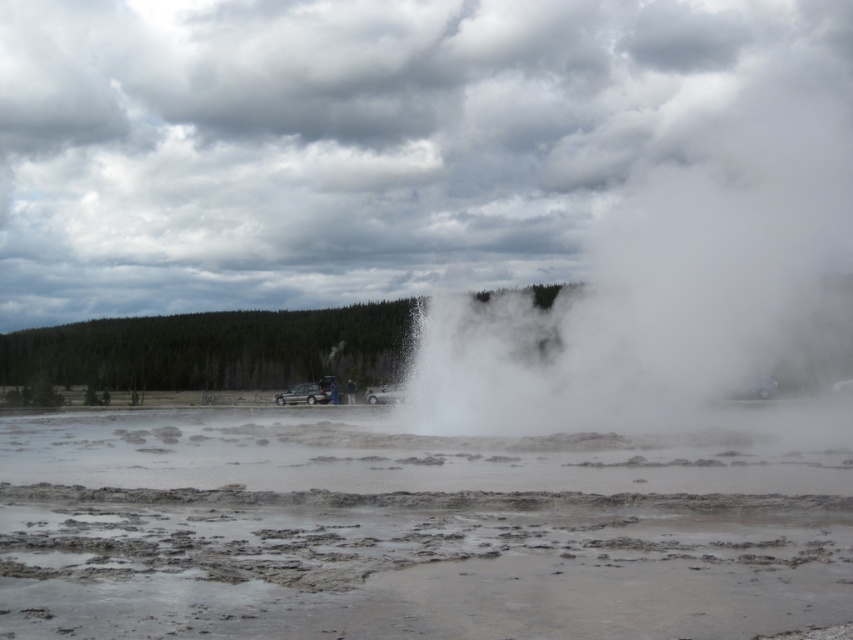
You are a hiker trying to cross the geothermal area. You see the muddy water at center and the white vapor at center. Which one is wider? Please choose between the two.

The white vapor at center is wider than the muddy water at center.

You are a hiker who wants to cross the area safely. Given that the muddy water at center and white vapor at center are both present, which one is taller and therefore poses a greater risk of blocking your path?

The white vapor at center is taller than the muddy water at center, so it poses a greater risk of blocking your path.